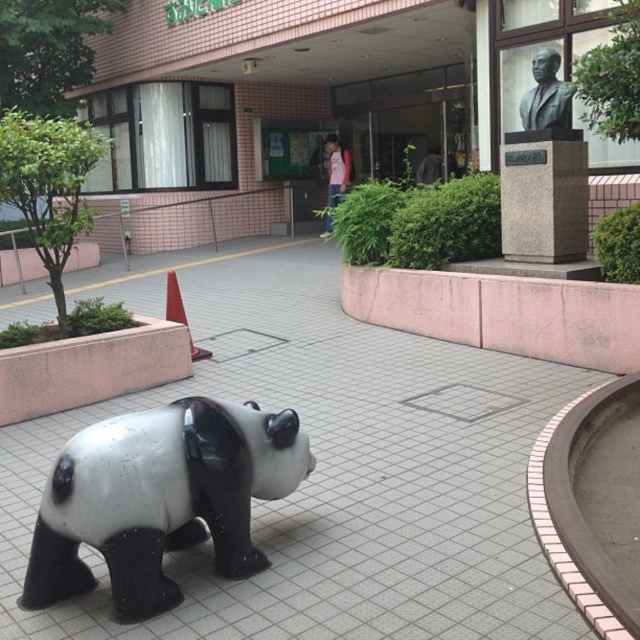
Between white glossy pavement at center and orange plastic traffic cone at lower left, which one is positioned higher?

orange plastic traffic cone at lower left is higher up.

Between white glossy pavement at center and orange plastic traffic cone at lower left, which one has more height?

Standing taller between the two is orange plastic traffic cone at lower left.

At what (x,y) coordinates should I click in order to perform the action: click on white glossy pavement at center. Please return your answer as a coordinate pair (x, y). The width and height of the screenshot is (640, 640). Looking at the image, I should click on (326, 467).

In the scene shown: Can you confirm if bronze bust at upper right is positioned to the right of orange plastic traffic cone at lower left?

Indeed, bronze bust at upper right is positioned on the right side of orange plastic traffic cone at lower left.

Can you confirm if bronze bust at upper right is shorter than orange plastic traffic cone at lower left?

No, bronze bust at upper right is not shorter than orange plastic traffic cone at lower left.

Is point (538, 115) behind point (166, 296)?

That is False.

The image size is (640, 640). What are the coordinates of `bronze bust at upper right` in the screenshot? It's located at (547, 96).

Is black and white glossy panda at center thinner than orange plastic traffic cone at lower left?

No.

Which is in front, point (136, 552) or point (205, 355)?

Point (136, 552)

The height and width of the screenshot is (640, 640). In order to click on black and white glossy panda at center in this screenshot , I will do `click(161, 499)`.